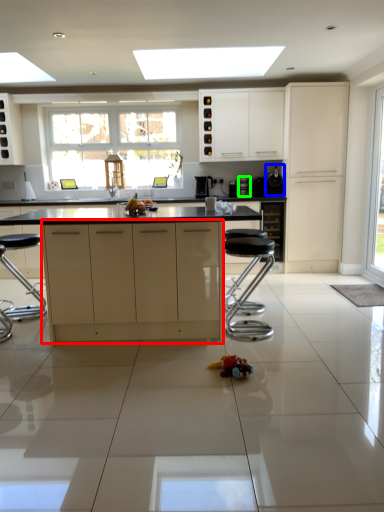
Question: Considering the real-world distances, which object is farthest from cabinetry (highlighted by a red box)? appliance (highlighted by a blue box) or appliance (highlighted by a green box)?

Choices:
 (A) appliance
 (B) appliance

Answer: (A)